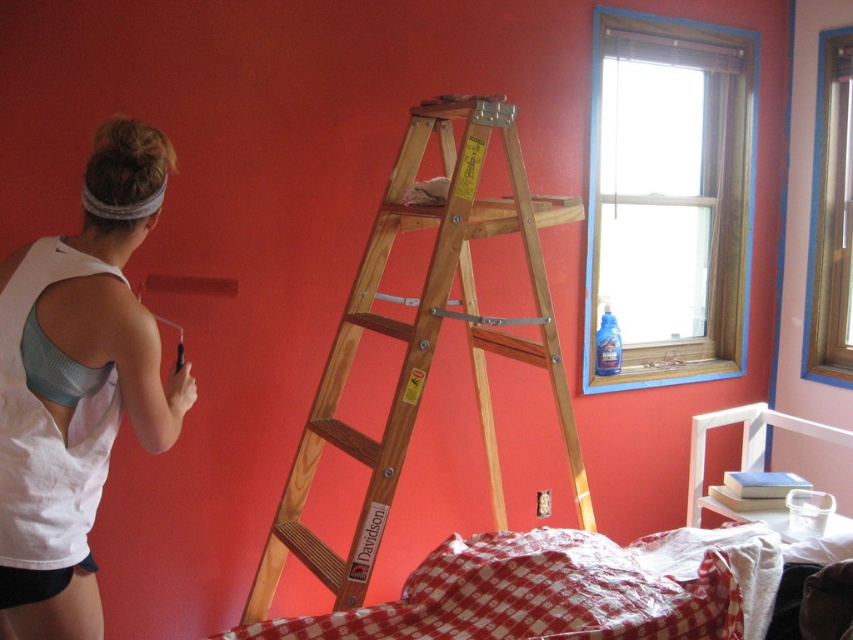
Between red checkered fabric at center and white fabric tank top at upper left, which one has more height?

white fabric tank top at upper left is taller.

Does red checkered fabric at center have a greater width compared to white fabric tank top at upper left?

Indeed, red checkered fabric at center has a greater width compared to white fabric tank top at upper left.

Between point (660, 572) and point (45, 426), which one is positioned behind?

Point (660, 572)

I want to click on red checkered fabric at center, so click(569, 589).

Can you confirm if wooden ladder at center is thinner than red checkered fabric at center?

Yes.

Measure the distance between point (444, 236) and camera.

Point (444, 236) and camera are 1.93 meters apart.

Find the location of a particular element. This screenshot has height=640, width=853. wooden ladder at center is located at coordinates pyautogui.click(x=424, y=340).

Is wooden ladder at center positioned in front of white fabric tank top at upper left?

No, it is not.

Which is behind, point (447, 253) or point (38, 292)?

The point (447, 253) is behind.

Does point (461, 220) lie behind point (138, 227)?

Yes, it is.

This screenshot has height=640, width=853. Identify the location of wooden ladder at center. (424, 340).